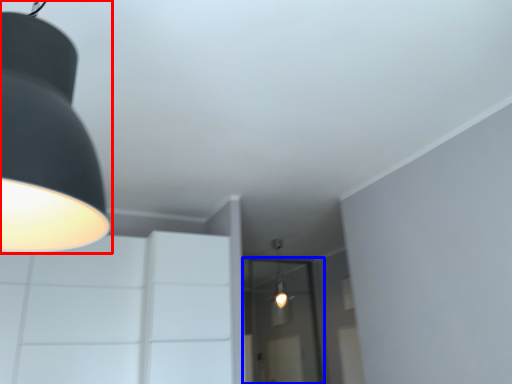
Question: Which of the following is the farthest to the observer, lamp (highlighted by a red box) or glass door (highlighted by a blue box)?

Choices:
 (A) lamp
 (B) glass door

Answer: (B)